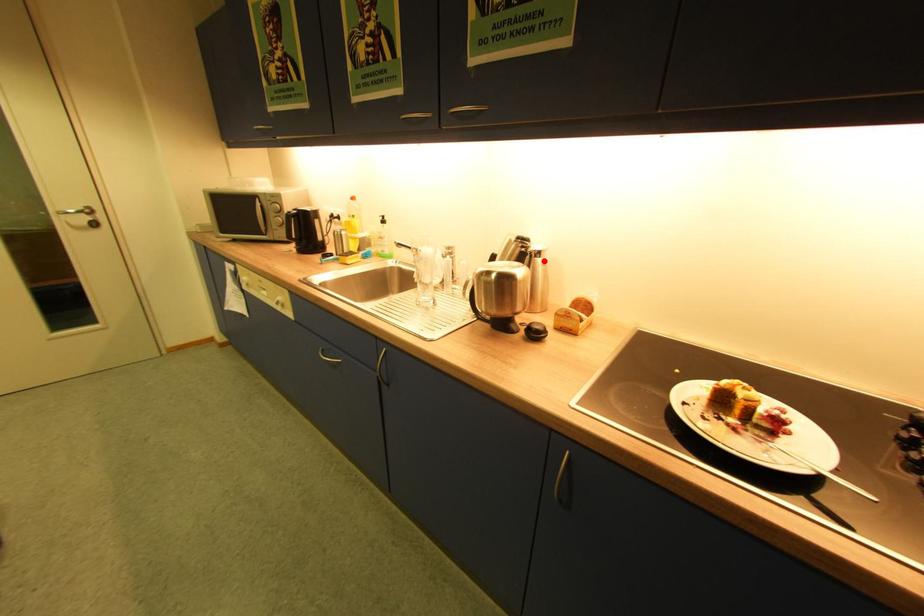
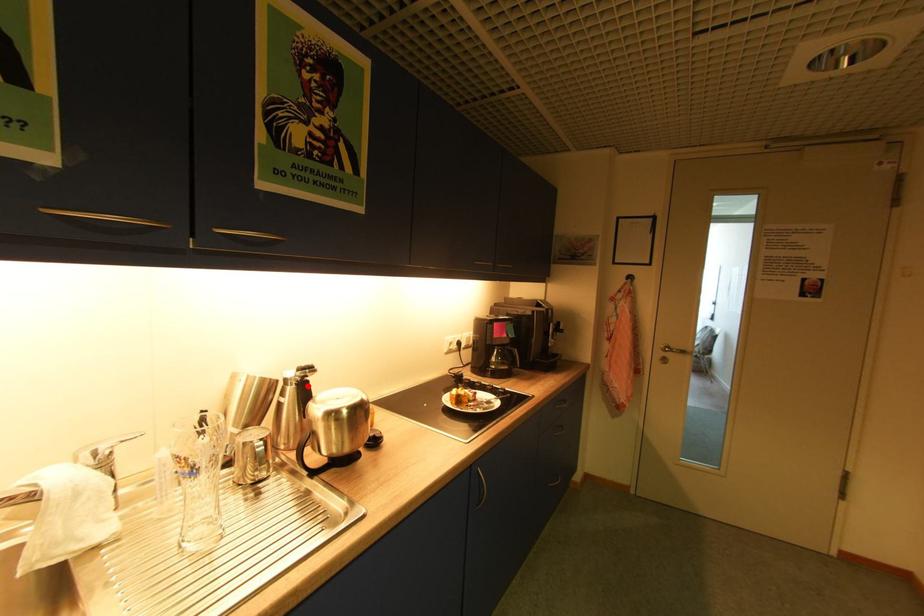
I am providing you with two images of the same scene from different viewpoints. A red point is marked on the first image and another point is marked on the second image. Is the red point in image1 aligned with the point shown in image2?

Yes